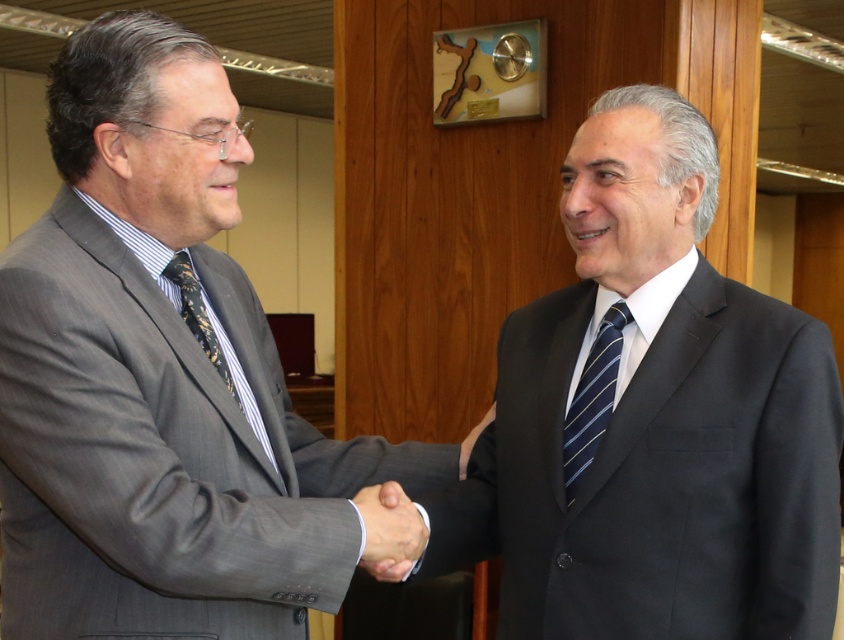
Who is more forward, (598,364) or (364,490)?

Point (364,490)

Who is lower down, dark gray suit at center or matte gray suit at center?

matte gray suit at center

Does point (545, 390) lie in front of point (398, 528)?

No, (545, 390) is further to viewer.

Locate an element on the screen. dark gray suit at center is located at coordinates (652, 419).

Between gray suit at left and matte gray suit at center, which one appears on the left side from the viewer's perspective?

gray suit at left

Does gray suit at left appear on the left side of matte gray suit at center?

Correct, you'll find gray suit at left to the left of matte gray suit at center.

The height and width of the screenshot is (640, 844). Identify the location of gray suit at left. (161, 378).

What are the coordinates of `gray suit at left` in the screenshot? It's located at (161, 378).

Looking at this image, who is positioned more to the left, blue striped tie at center or black silk tie at left?

black silk tie at left

Is blue striped tie at center to the right of black silk tie at left from the viewer's perspective?

Correct, you'll find blue striped tie at center to the right of black silk tie at left.

Is point (594, 372) in front of point (258, 442)?

No.

You are a GUI agent. You are given a task and a screenshot of the screen. Output one action in this format:
    pyautogui.click(x=<x>, y=<y>)
    Task: Click on the blue striped tie at center
    This screenshot has width=844, height=640.
    Given the screenshot: What is the action you would take?
    pyautogui.click(x=592, y=397)